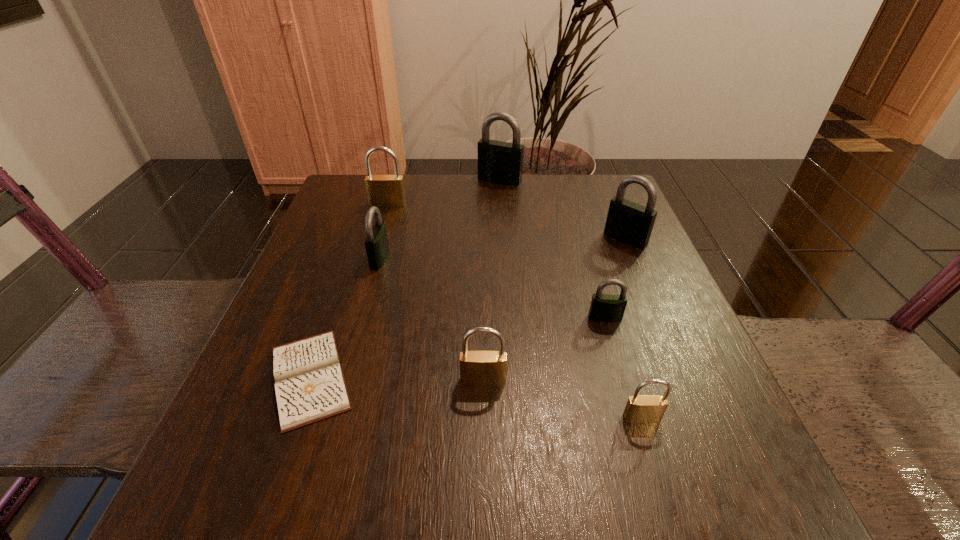
You are a GUI agent. You are given a task and a screenshot of the screen. Output one action in this format:
    pyautogui.click(x=<x>, y=<y>)
    Task: Click on the vacant point located 0.060m on the front-facing side of the nearest padlock
    The height and width of the screenshot is (540, 960).
    Given the screenshot: What is the action you would take?
    pyautogui.click(x=656, y=464)

You are a GUI agent. You are given a task and a screenshot of the screen. Output one action in this format:
    pyautogui.click(x=<x>, y=<y>)
    Task: Click on the vacant area located on the right of the diary
    This screenshot has height=540, width=960.
    Given the screenshot: What is the action you would take?
    pyautogui.click(x=494, y=377)

Locate an element on the screen. The width and height of the screenshot is (960, 540). diary at the left edge is located at coordinates coord(310,386).

Identify the location of object located in the far left corner section of the desktop. (386, 191).

The height and width of the screenshot is (540, 960). Find the location of `vacant area at the far edge of the desktop`. vacant area at the far edge of the desktop is located at coordinates (477, 208).

Find the location of a particular element. vacant region at the near edge is located at coordinates (484, 514).

You are a GUI agent. You are given a task and a screenshot of the screen. Output one action in this format:
    pyautogui.click(x=<x>, y=<y>)
    Task: Click on the vacant region at the left edge of the desktop
    
    Given the screenshot: What is the action you would take?
    pyautogui.click(x=306, y=321)

The image size is (960, 540). I want to click on vacant space at the right edge, so click(582, 271).

Locate an element on the screen. Image resolution: width=960 pixels, height=540 pixels. vacant point at the far left corner is located at coordinates (394, 211).

This screenshot has height=540, width=960. Identify the location of free space at the near left corner. (239, 528).